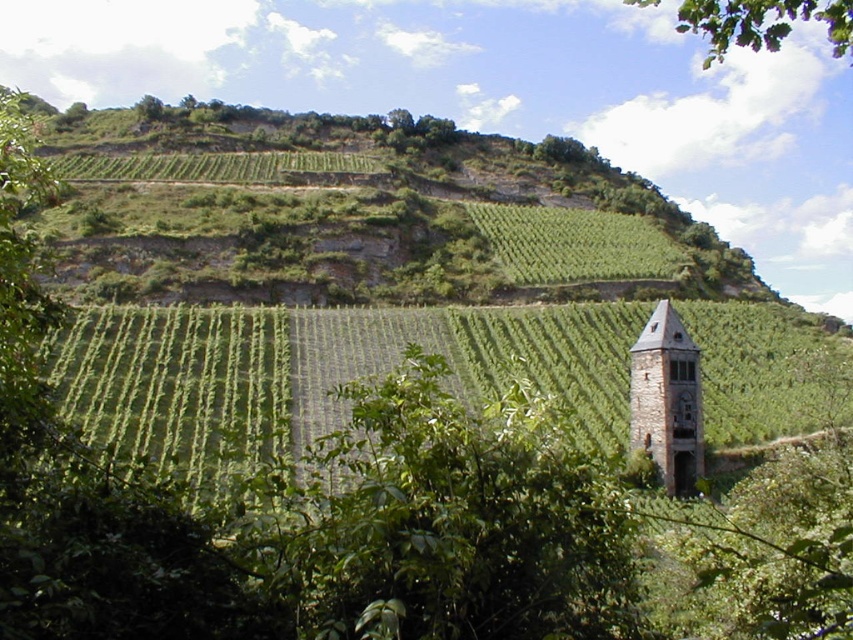
You are an architect visiting the vineyard and want to compare the sizes of the brown stone bell tower at right and the green leafy tree at upper right. Which one appears larger in the image?

The green leafy tree at upper right is larger than the brown stone bell tower at right.

You are standing in the vineyard and want to take a photo of both the brown stone bell tower at right and the green leafy tree at upper right in the same frame. Which object should you position closer to the left side of your camera viewfinder to include both in the shot?

You should position the brown stone bell tower at right closer to the left side of your camera viewfinder because it is located to the left of the green leafy tree at upper right.

From the picture: You are standing at the base of the rustic stone tower in the vineyard and see two points marked in the scene. One is at point (x=677, y=323) and the other at point (x=708, y=44). Which point is closer to you?

Point (x=677, y=323) is in front of point (x=708, y=44), so it is closer to you.